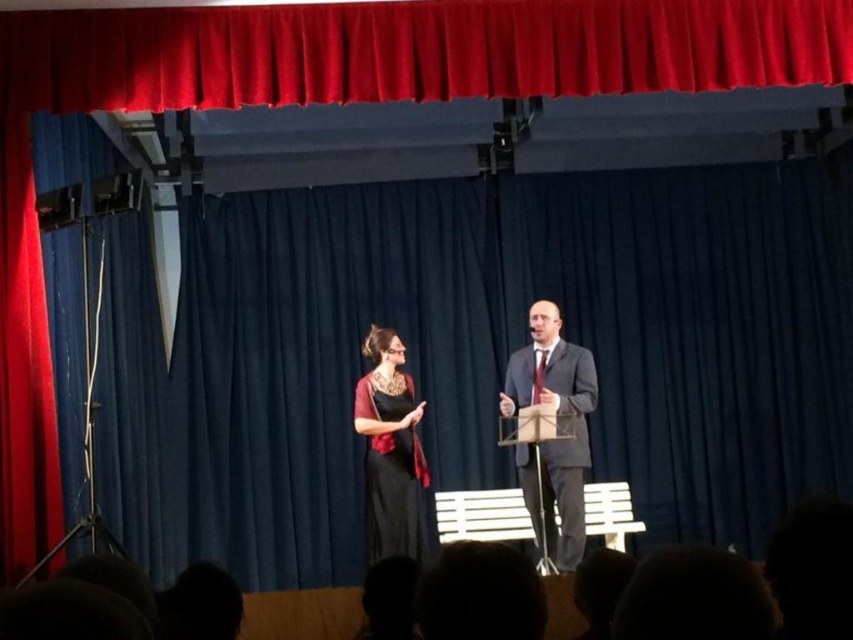
Does matte black suit at center have a lesser height compared to black satin dress at center?

In fact, matte black suit at center may be taller than black satin dress at center.

Which of these two, matte black suit at center or black satin dress at center, stands taller?

matte black suit at center

Between point (567, 486) and point (405, 556), which one is positioned in front?

Positioned in front is point (567, 486).

Where is `matte black suit at center`? The image size is (853, 640). matte black suit at center is located at coordinates 556,429.